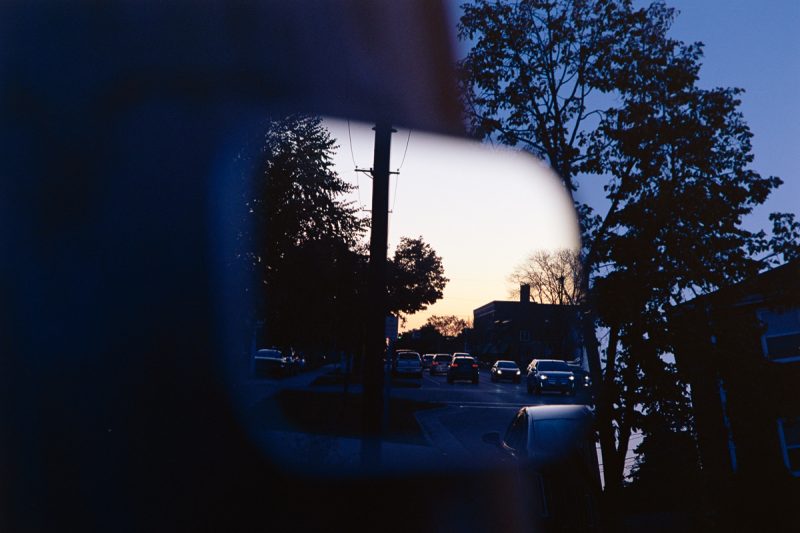
Identify the location of window. (782, 324).